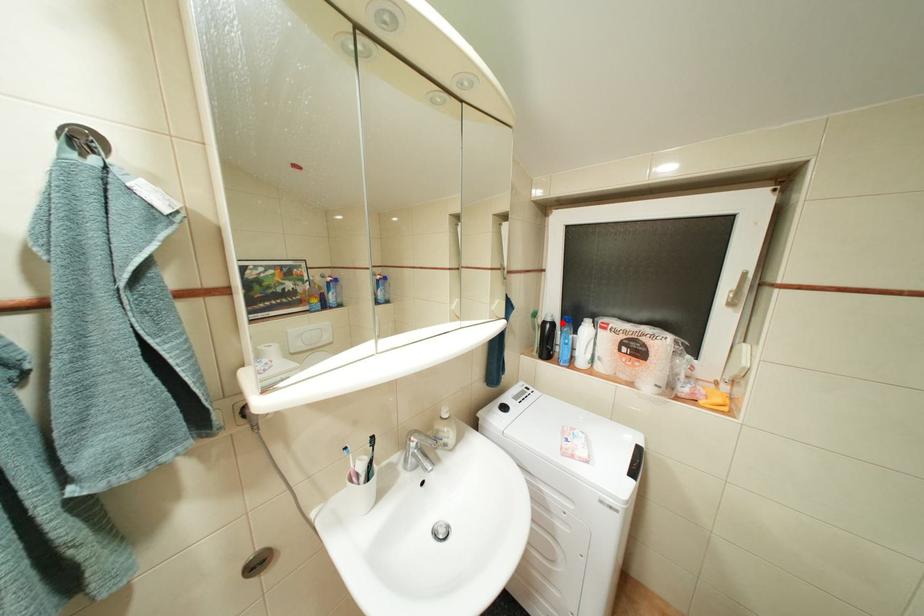
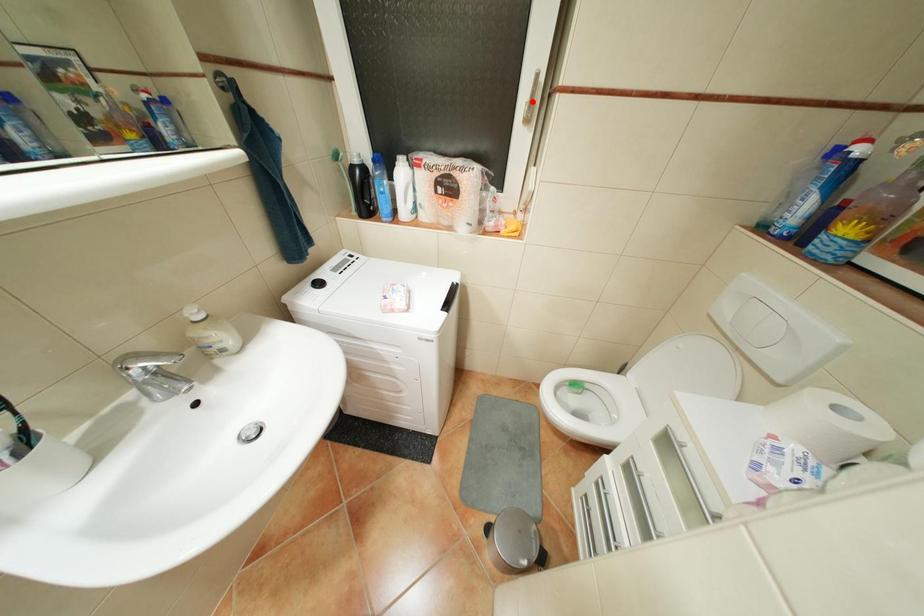
I am providing you with two images of the same scene from different viewpoints. A red point is marked on the first image and another point is marked on the second image. Does the point marked in image1 correspond to the same location as the one in image2?

No